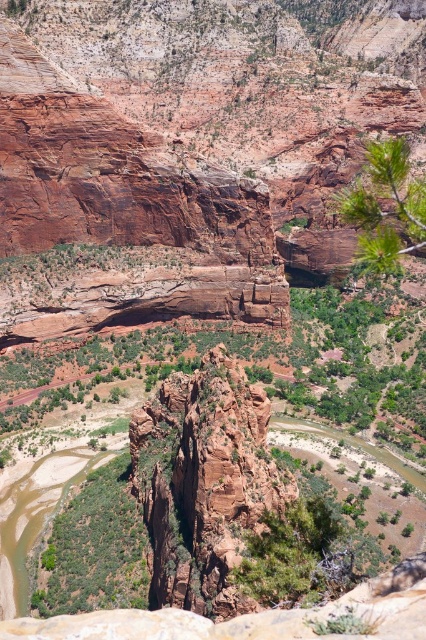
Question: Is green leafy shrubs at center to the right of green leafy branch at upper right from the viewer's perspective?

Choices:
 (A) yes
 (B) no

Answer: (B)

Question: Considering the relative positions of green leafy shrubs at center and green leafy branch at upper right in the image provided, where is green leafy shrubs at center located with respect to green leafy branch at upper right?

Choices:
 (A) right
 (B) left

Answer: (B)

Question: Among these objects, which one is nearest to the camera?

Choices:
 (A) green leafy branch at upper right
 (B) green leafy shrubs at center

Answer: (B)

Question: Does rustic sandstone cliff at center have a greater width compared to green leafy branch at upper right?

Choices:
 (A) yes
 (B) no

Answer: (B)

Question: Which object is farther from the camera taking this photo?

Choices:
 (A) green leafy branch at upper right
 (B) green leafy shrubs at center
 (C) rustic sandstone cliff at center

Answer: (A)

Question: Which object appears closest to the camera in this image?

Choices:
 (A) green leafy branch at upper right
 (B) green leafy shrubs at center

Answer: (B)